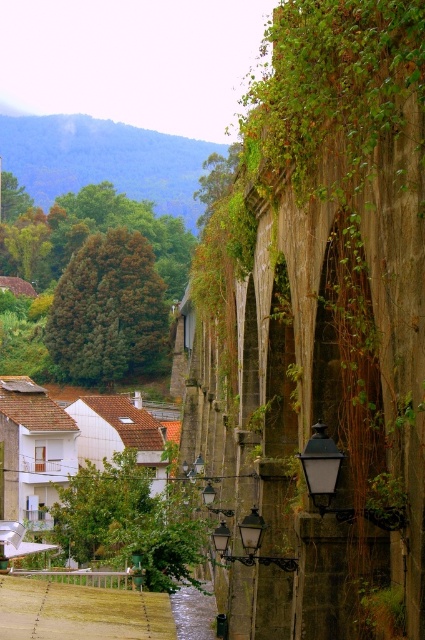
Question: Does green leafy ivy at center lie in front of white matte house at lower left?

Choices:
 (A) no
 (B) yes

Answer: (A)

Question: Which point is farther from the camera taking this photo?

Choices:
 (A) (144, 244)
 (B) (53, 467)

Answer: (A)

Question: Does green leafy ivy at center lie in front of white matte house at lower left?

Choices:
 (A) no
 (B) yes

Answer: (A)

Question: Which point is closer to the camera?

Choices:
 (A) white matte house at lower left
 (B) green leafy ivy at center
 (C) blue-green vegetation at upper left

Answer: (A)

Question: Is blue-green vegetation at upper left in front of white matte house at lower left?

Choices:
 (A) yes
 (B) no

Answer: (B)

Question: Which point is farther to the camera?

Choices:
 (A) green leafy ivy at center
 (B) white matte house at lower left
 (C) blue-green vegetation at upper left

Answer: (C)